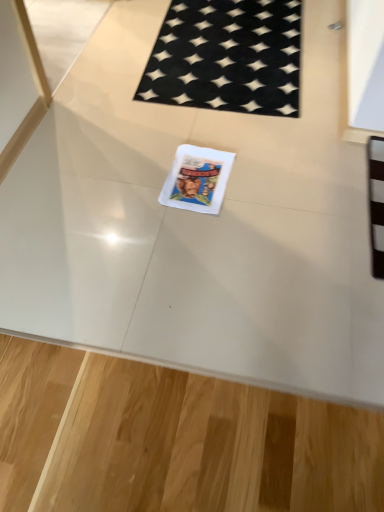
Measure the distance between point (249, 31) and camera.

The distance of point (249, 31) from camera is 6.55 feet.

Describe the element at coordinates (227, 57) in the screenshot. I see `black woven mat at upper center` at that location.

This screenshot has width=384, height=512. Identify the location of black woven mat at upper center. (227, 57).

Measure the distance between black woven mat at upper center and camera.

A distance of 5.45 feet exists between black woven mat at upper center and camera.

What is the approximate height of white paper comic book at center?

white paper comic book at center is 0.78 inches in height.

Describe the element at coordinates (197, 179) in the screenshot. I see `white paper comic book at center` at that location.

Where is `white paper comic book at center`? white paper comic book at center is located at coordinates (197, 179).

The height and width of the screenshot is (512, 384). What are the coordinates of `black woven mat at upper center` in the screenshot? It's located at (227, 57).

Which object is positioned more to the left, white paper comic book at center or black woven mat at upper center?

white paper comic book at center is more to the left.

Who is more distant, white paper comic book at center or black woven mat at upper center?

black woven mat at upper center is further away from the camera.

Is point (175, 198) positioned before point (265, 51)?

Yes, it is in front of point (265, 51).

From the image's perspective, is white paper comic book at center located above or below black woven mat at upper center?

white paper comic book at center is below black woven mat at upper center.

From a real-world perspective, is white paper comic book at center positioned above or below black woven mat at upper center?

white paper comic book at center is situated higher than black woven mat at upper center in the real world.

From the picture: Is white paper comic book at center wider than black woven mat at upper center?

No.

Consider the image. From their relative heights in the image, would you say white paper comic book at center is taller or shorter than black woven mat at upper center?

Considering their sizes, white paper comic book at center has more height than black woven mat at upper center.

Consider the image. Considering the sizes of objects white paper comic book at center and black woven mat at upper center in the image provided, who is bigger, white paper comic book at center or black woven mat at upper center?

With larger size is black woven mat at upper center.

Is white paper comic book at center outside of black woven mat at upper center?

That's correct, white paper comic book at center is outside of black woven mat at upper center.

Are white paper comic book at center and black woven mat at upper center located far from each other?

They are positioned close to each other.

Is white paper comic book at center looking in the opposite direction of black woven mat at upper center?

Yes, white paper comic book at center is positioned with its back facing black woven mat at upper center.

How many degrees apart are the facing directions of white paper comic book at center and black woven mat at upper center?

white paper comic book at center and black woven mat at upper center are facing 5.01 degrees away from each other.

At what (x,y) coordinates should I click in order to perform the action: click on mat located on the right of white paper comic book at center. Please return your answer as a coordinate pair (x, y). The image size is (384, 512). Looking at the image, I should click on (227, 57).

Based on their positions, is black woven mat at upper center located to the left or right of white paper comic book at center?

Clearly, black woven mat at upper center is on the right of white paper comic book at center in the image.

Which object is more forward, black woven mat at upper center or white paper comic book at center?

white paper comic book at center is in front.

Does point (193, 49) lie behind point (206, 152)?

Yes, it is.

From the image's perspective, does black woven mat at upper center appear higher than white paper comic book at center?

Yes, from the image's perspective, black woven mat at upper center is on top of white paper comic book at center.

From a real-world perspective, between black woven mat at upper center and white paper comic book at center, who is vertically higher?

white paper comic book at center.

Considering the relative sizes of black woven mat at upper center and white paper comic book at center in the image provided, is black woven mat at upper center wider than white paper comic book at center?

Yes, black woven mat at upper center is wider than white paper comic book at center.

Between black woven mat at upper center and white paper comic book at center, which one has more height?

With more height is white paper comic book at center.

Looking at the image, does black woven mat at upper center seem bigger or smaller compared to white paper comic book at center?

Considering their sizes, black woven mat at upper center takes up more space than white paper comic book at center.

Is black woven mat at upper center inside the boundaries of white paper comic book at center, or outside?

black woven mat at upper center is outside white paper comic book at center.

In the scene shown: Is black woven mat at upper center not close to white paper comic book at center?

Actually, black woven mat at upper center and white paper comic book at center are a little close together.

Is black woven mat at upper center looking in the opposite direction of white paper comic book at center?

No, black woven mat at upper center is not facing the opposite direction of white paper comic book at center.

Can you tell me how much black woven mat at upper center and white paper comic book at center differ in facing direction?

There is a 5.01-degree angle between the facing directions of black woven mat at upper center and white paper comic book at center.

Where is `mat that is under the white paper comic book at center (from a real-world perspective)`? This screenshot has width=384, height=512. mat that is under the white paper comic book at center (from a real-world perspective) is located at coordinates (227, 57).

Identify the location of comic book above the black woven mat at upper center (from a real-world perspective). This screenshot has width=384, height=512. (197, 179).

At what (x,y) coordinates should I click in order to perform the action: click on comic book on the left of black woven mat at upper center. Please return your answer as a coordinate pair (x, y). Image resolution: width=384 pixels, height=512 pixels. Looking at the image, I should click on (197, 179).